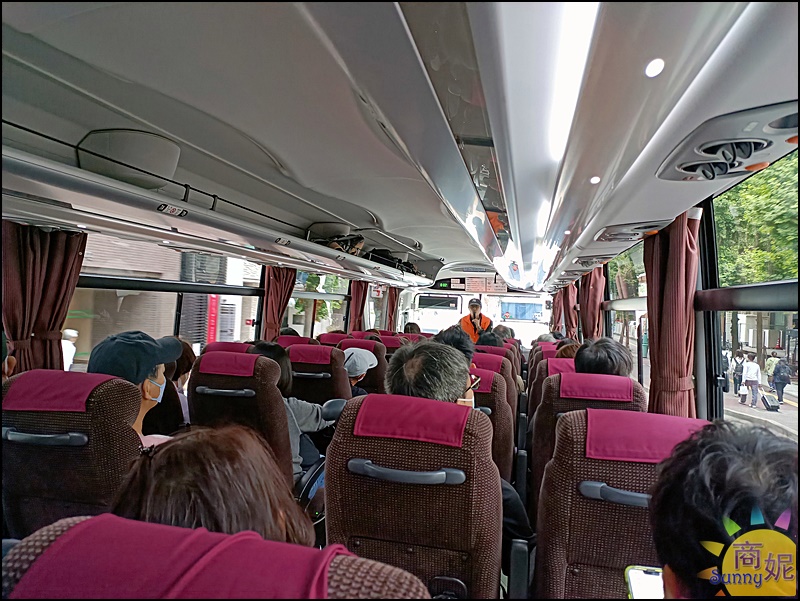
Where is `handle`? The width and height of the screenshot is (800, 601). handle is located at coordinates (388, 471), (614, 496), (557, 413), (488, 409), (310, 371), (244, 386), (66, 435).